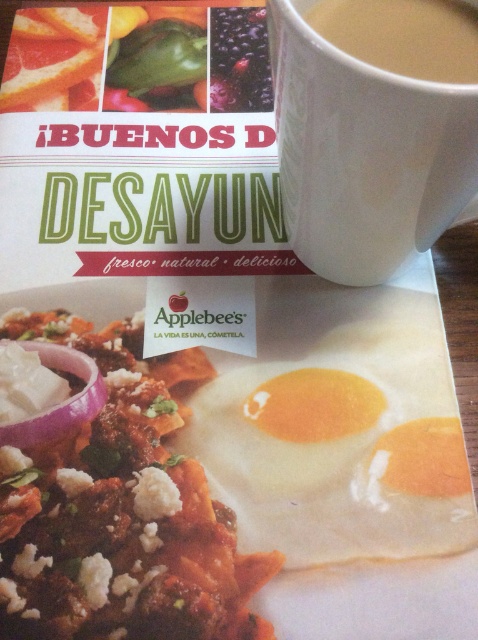
Question: Is white ceramic mug at upper center to the right of purple translucent onion at lower left from the viewer's perspective?

Choices:
 (A) yes
 (B) no

Answer: (A)

Question: Which of these objects is positioned closest to the white ceramic mug at upper center?

Choices:
 (A) white matte mug at upper center
 (B) purple translucent onion at lower left
 (C) white fried egg at center

Answer: (A)

Question: Which object is closer to the camera taking this photo?

Choices:
 (A) purple translucent onion at lower left
 (B) white matte mug at upper center
 (C) white ceramic mug at upper center
 (D) white fried egg at center

Answer: (C)

Question: Can you confirm if white fried egg at center is positioned below white matte mug at upper center?

Choices:
 (A) yes
 (B) no

Answer: (A)

Question: Does white ceramic mug at upper center appear on the left side of purple translucent onion at lower left?

Choices:
 (A) yes
 (B) no

Answer: (B)

Question: Which is nearer to the white fried egg at center?

Choices:
 (A) purple translucent onion at lower left
 (B) white matte mug at upper center
 (C) white ceramic mug at upper center

Answer: (A)